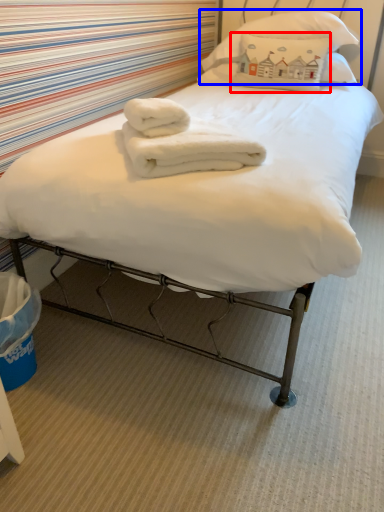
Question: Which of the following is the closest to the observer, pillow (highlighted by a red box) or pillow (highlighted by a blue box)?

Choices:
 (A) pillow
 (B) pillow

Answer: (B)